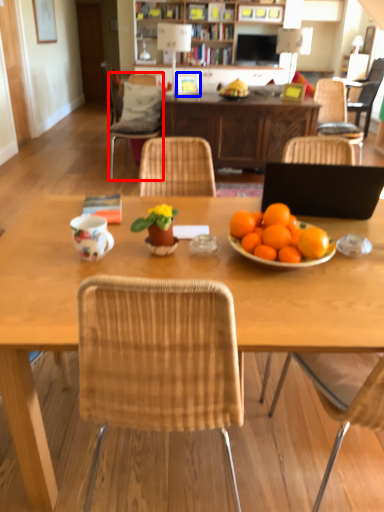
Question: Which object appears closest to the camera in this image, chair (highlighted by a red box) or picture frame (highlighted by a blue box)?

Choices:
 (A) chair
 (B) picture frame

Answer: (A)